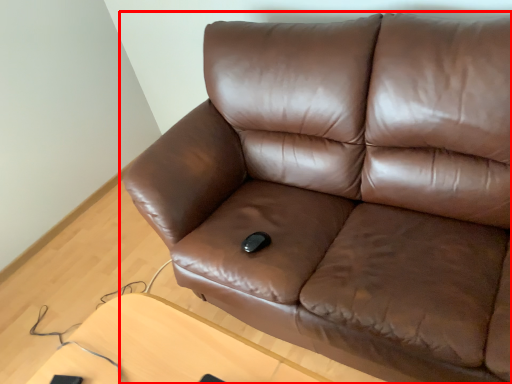
Question: From the image's perspective, where is studio couch (annotated by the red box) located in relation to table in the image?

Choices:
 (A) below
 (B) above

Answer: (B)